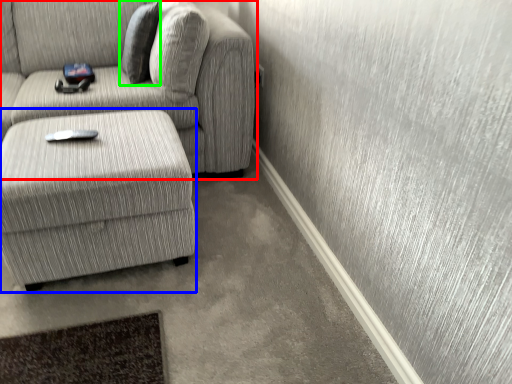
Question: Based on their relative distances, which object is farther from studio couch (highlighted by a red box)? Choose from table (highlighted by a blue box) and pillow (highlighted by a green box).

Choices:
 (A) table
 (B) pillow

Answer: (A)